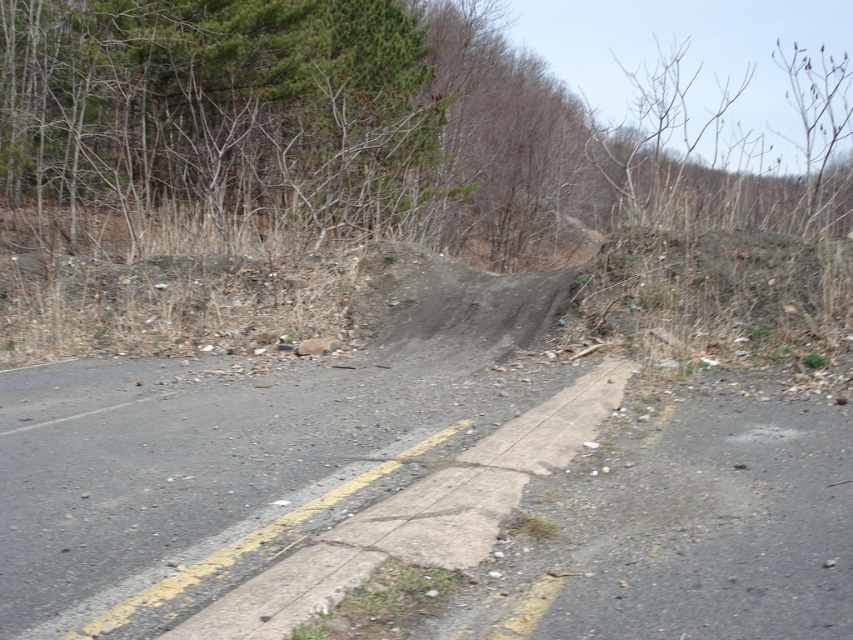
The width and height of the screenshot is (853, 640). I want to click on green leafy tree at upper left, so click(218, 116).

Is green leafy tree at upper left taller than gravelly asphalt road at center?

Yes, green leafy tree at upper left is taller than gravelly asphalt road at center.

Does point (39, 214) come in front of point (596, 408)?

No, (39, 214) is behind (596, 408).

This screenshot has width=853, height=640. Find the location of `green leafy tree at upper left`. green leafy tree at upper left is located at coordinates (218, 116).